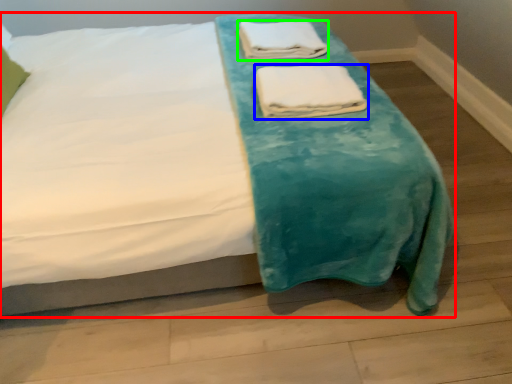
Question: Based on their relative distances, which object is farther from bed (highlighted by a red box)? Choose from towel (highlighted by a blue box) and towel (highlighted by a green box).

Choices:
 (A) towel
 (B) towel

Answer: (B)